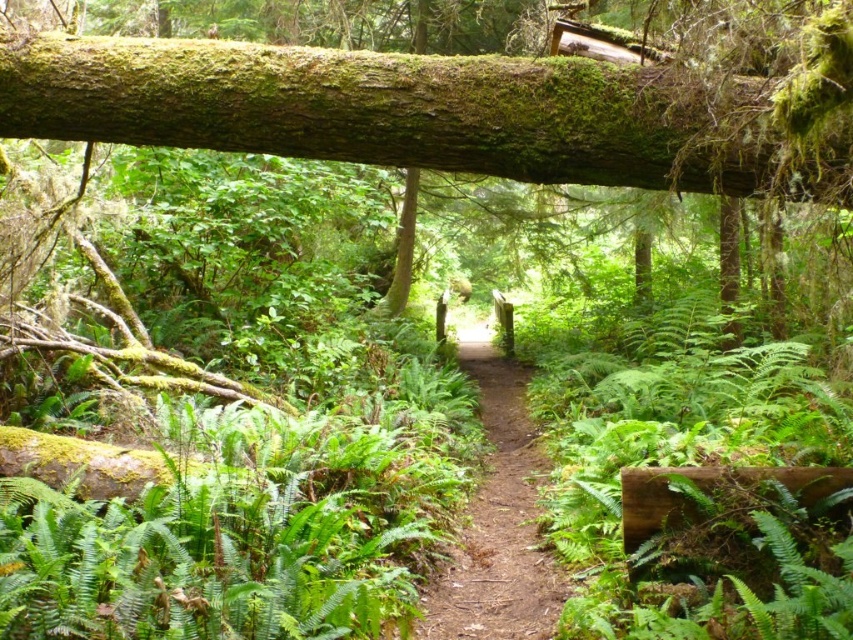
Question: In this image, where is green mossy log at upper center located relative to dirt path at center?

Choices:
 (A) below
 (B) above

Answer: (B)

Question: Can you confirm if dirt path at center is wider than green mossy log at center?

Choices:
 (A) no
 (B) yes

Answer: (B)

Question: Which point is farther to the camera?

Choices:
 (A) (479, 515)
 (B) (386, 301)
 (C) (270, 86)

Answer: (B)

Question: Which point is closer to the camera taking this photo?

Choices:
 (A) (601, 86)
 (B) (497, 515)
 (C) (404, 298)

Answer: (A)

Question: Which point is closer to the camera?

Choices:
 (A) (427, 104)
 (B) (486, 355)
 (C) (408, 273)

Answer: (A)

Question: Can you confirm if dirt path at center is wider than green mossy log at center?

Choices:
 (A) no
 (B) yes

Answer: (B)